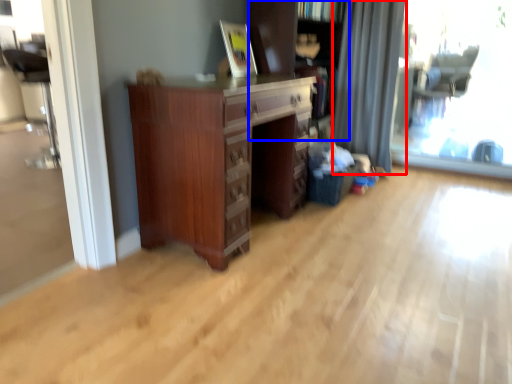
Question: Which object appears closest to the camera in this image, curtain (highlighted by a red box) or bookcase (highlighted by a blue box)?

Choices:
 (A) curtain
 (B) bookcase

Answer: (B)